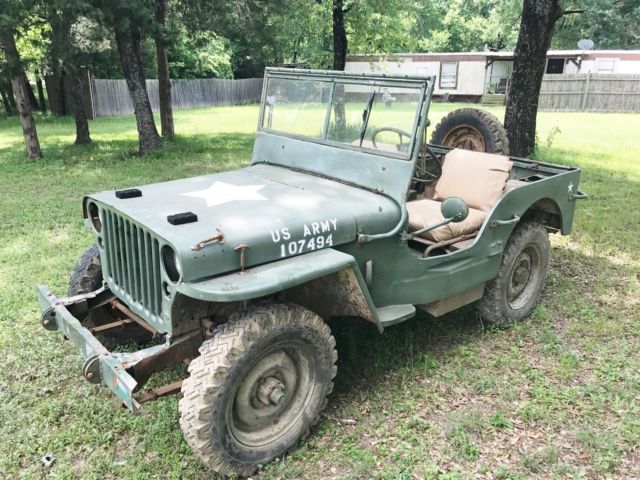
This screenshot has height=480, width=640. What are the coordinates of `seat` in the screenshot? It's located at (425, 216).